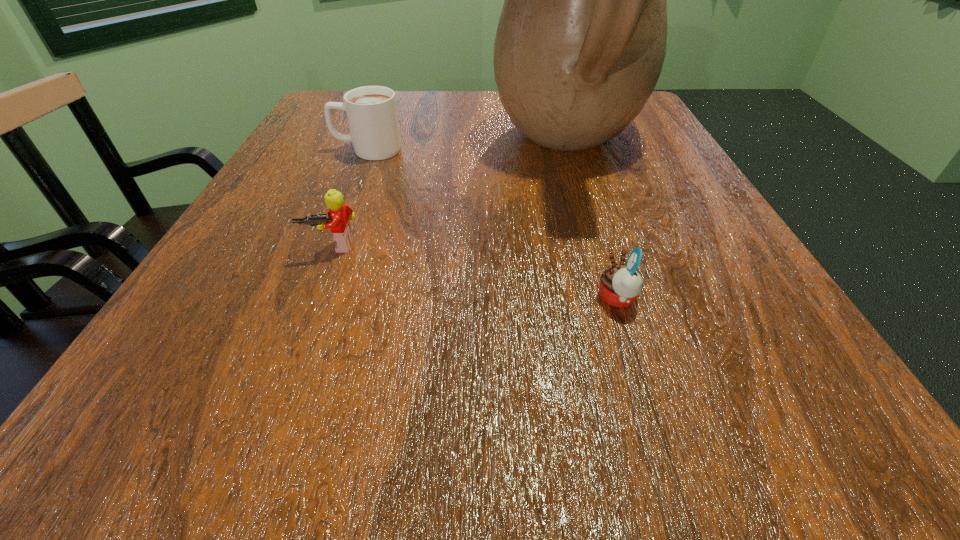
I want to click on free spot at the near edge of the desktop, so click(x=460, y=406).

The height and width of the screenshot is (540, 960). In order to click on free space at the left edge of the desktop in this screenshot , I will do `click(206, 381)`.

Find the location of a particular element. The height and width of the screenshot is (540, 960). free space at the right edge of the desktop is located at coordinates (644, 179).

This screenshot has height=540, width=960. I want to click on vacant area that lies between the nearest object and the cappuccino, so click(x=492, y=224).

You are a GUI agent. You are given a task and a screenshot of the screen. Output one action in this format:
    pyautogui.click(x=<x>, y=<y>)
    Task: Click on the unoccupied area between the cream pitcher and the second shortest object
    
    Given the screenshot: What is the action you would take?
    pos(451,196)

At what (x,y) coordinates should I click in order to perform the action: click on empty space between the tallest object and the shortest object. Please return your answer as a coordinate pair (x, y). The width and height of the screenshot is (960, 540). Looking at the image, I should click on (593, 222).

Locate an element on the screen. free space between the cappuccino and the third tallest object is located at coordinates (350, 198).

I want to click on free space between the cream pitcher and the cappuccino, so click(x=468, y=148).

Identify the location of free point between the second nearest object and the tallest object. (451, 196).

Locate an element on the screen. This screenshot has height=540, width=960. free space between the tallest object and the cappuccino is located at coordinates (468, 148).